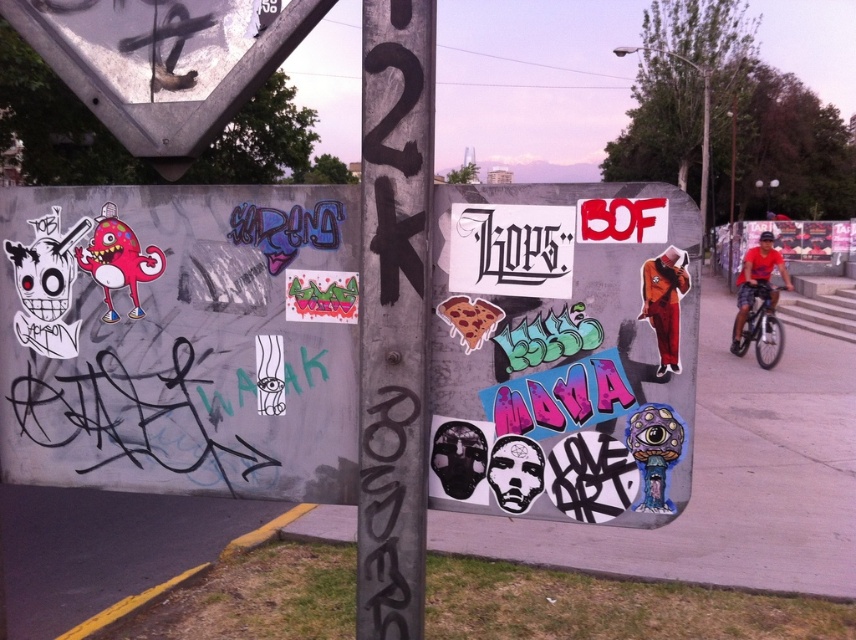
Question: Is the position of white paper stickers at center more distant than that of black painted pole at center?

Choices:
 (A) yes
 (B) no

Answer: (B)

Question: Which of the following is the closest to the observer?

Choices:
 (A) white paper stickers at center
 (B) black painted pole at center

Answer: (A)

Question: Is white paper stickers at center above black painted pole at center?

Choices:
 (A) no
 (B) yes

Answer: (A)

Question: Which object appears farthest from the camera in this image?

Choices:
 (A) white paper stickers at center
 (B) black painted pole at center

Answer: (B)

Question: Is white paper stickers at center above black painted pole at center?

Choices:
 (A) no
 (B) yes

Answer: (A)